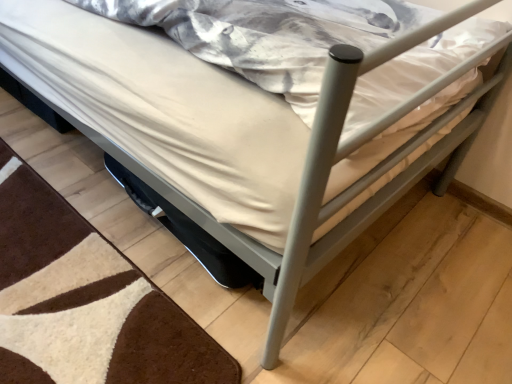
Identify the location of unoccupied region to the right of brown textured mat at lower left. (311, 284).